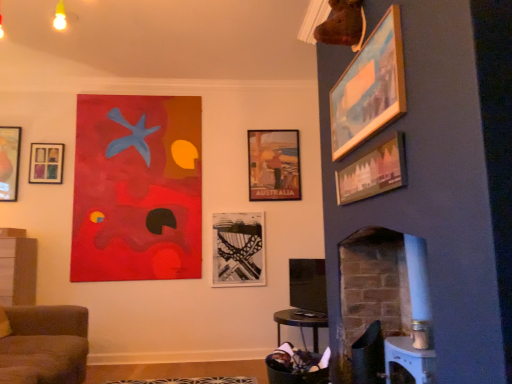
This screenshot has width=512, height=384. I want to click on free point above wooden picture frame at upper right, which appears as the second picture frame when viewed from the front (from a real-world perspective), so click(358, 45).